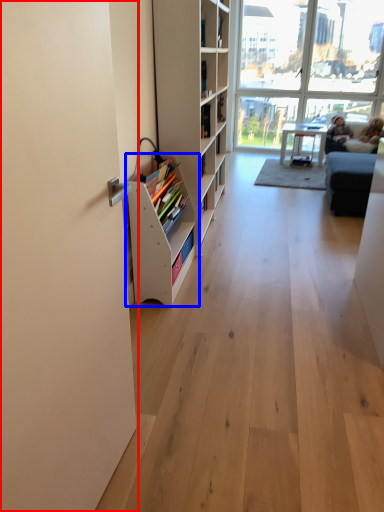
Question: Which point is closer to the camera, screen door (highlighted by a red box) or shelf (highlighted by a blue box)?

Choices:
 (A) screen door
 (B) shelf

Answer: (A)